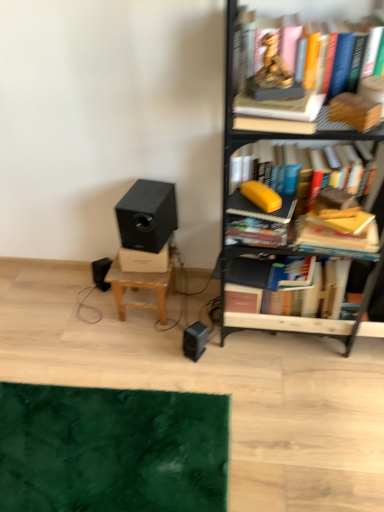
This screenshot has height=512, width=384. What are the coordinates of `free spot to the right of black plastic speaker at lower center` in the screenshot? It's located at (239, 353).